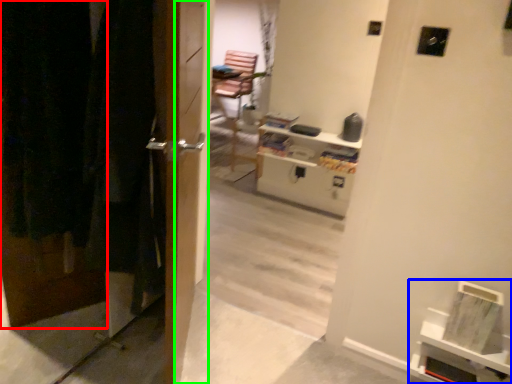
Question: Based on their relative distances, which object is nearer to door (highlighted by a red box)? Choose from shelf (highlighted by a blue box) and screen door (highlighted by a green box).

Choices:
 (A) shelf
 (B) screen door

Answer: (B)